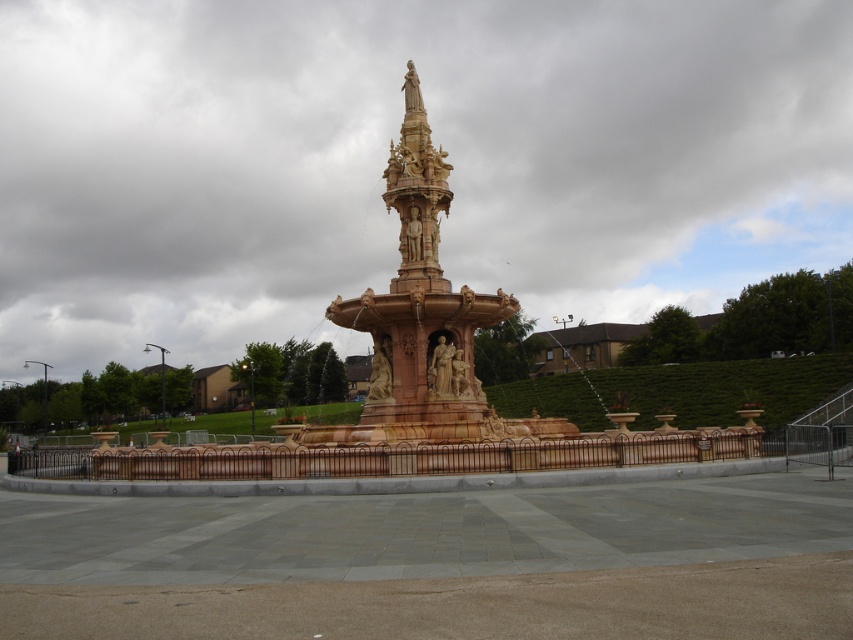
Question: Is the position of polished stone fountain at center more distant than that of golden stone spire at center?

Choices:
 (A) no
 (B) yes

Answer: (A)

Question: Observing the image, what is the correct spatial positioning of polished stone fountain at center in reference to golden stone spire at center?

Choices:
 (A) above
 (B) below

Answer: (B)

Question: Is polished stone fountain at center smaller than golden stone spire at center?

Choices:
 (A) yes
 (B) no

Answer: (B)

Question: Among these objects, which one is nearest to the camera?

Choices:
 (A) golden stone spire at center
 (B) polished stone fountain at center

Answer: (B)